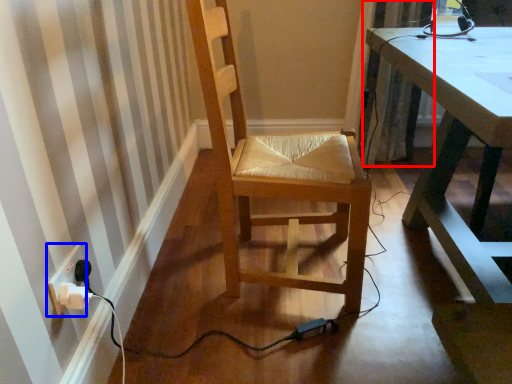
Question: Which object appears farthest to the camera in this image, curtain (highlighted by a red box) or electric outlet (highlighted by a blue box)?

Choices:
 (A) curtain
 (B) electric outlet

Answer: (A)